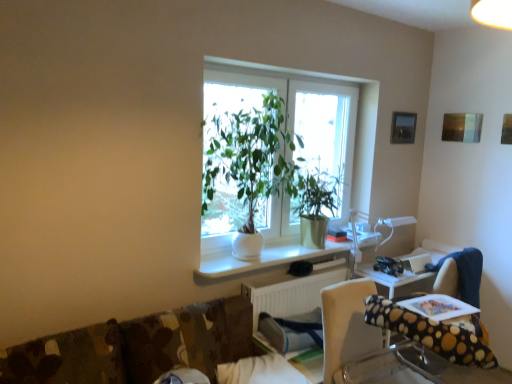
Question: Should I look upward or downward to see white ceramic plant at center?

Choices:
 (A) down
 (B) up

Answer: (B)

Question: Is metallic silver picture frame at upper right far away from white glossy computer desk at center?

Choices:
 (A) yes
 (B) no

Answer: (A)

Question: Does metallic silver picture frame at upper right have a lesser height compared to white glossy computer desk at center?

Choices:
 (A) no
 (B) yes

Answer: (A)

Question: Would you say white glossy computer desk at center is part of metallic silver picture frame at upper right's contents?

Choices:
 (A) yes
 (B) no

Answer: (B)

Question: Considering the relative sizes of metallic silver picture frame at upper right and white glossy computer desk at center in the image provided, is metallic silver picture frame at upper right bigger than white glossy computer desk at center?

Choices:
 (A) no
 (B) yes

Answer: (A)

Question: Is metallic silver picture frame at upper right oriented towards white glossy computer desk at center?

Choices:
 (A) yes
 (B) no

Answer: (B)

Question: Is metallic silver picture frame at upper right closer to camera compared to white glossy computer desk at center?

Choices:
 (A) no
 (B) yes

Answer: (A)

Question: Is green matte plant at center bigger than metallic silver picture frame at upper right?

Choices:
 (A) yes
 (B) no

Answer: (A)

Question: Does green matte plant at center have a greater width compared to metallic silver picture frame at upper right?

Choices:
 (A) yes
 (B) no

Answer: (A)

Question: Considering the relative sizes of green matte plant at center and metallic silver picture frame at upper right in the image provided, is green matte plant at center smaller than metallic silver picture frame at upper right?

Choices:
 (A) no
 (B) yes

Answer: (A)

Question: From a real-world perspective, is green matte plant at center on top of metallic silver picture frame at upper right?

Choices:
 (A) yes
 (B) no

Answer: (B)

Question: From the image's perspective, would you say green matte plant at center is positioned over metallic silver picture frame at upper right?

Choices:
 (A) no
 (B) yes

Answer: (A)

Question: Is green matte plant at center aimed at metallic silver picture frame at upper right?

Choices:
 (A) yes
 (B) no

Answer: (B)

Question: Is white ceramic plant at center positioned in front of white plastic radiator at lower center?

Choices:
 (A) yes
 (B) no

Answer: (A)